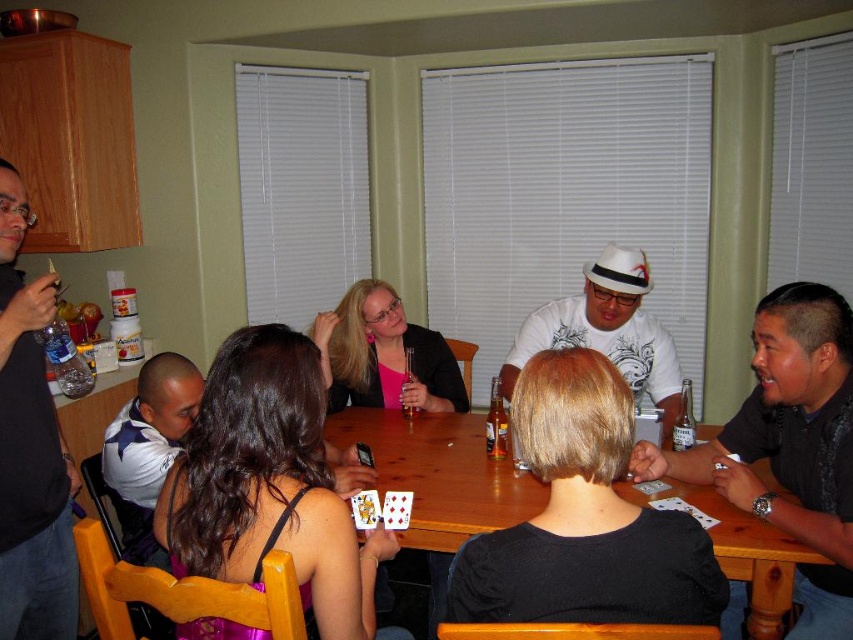
You are planning to place a large rectangular board game on the wooden table at center. Considering the black matte shirt at left is currently occupying space on the table, can you determine if there is enough space for the board game?

The wooden table at center is wider than the black matte shirt at left, so there should be sufficient space to place the large rectangular board game on the wooden table at center after adjusting the position of the black matte shirt at left.